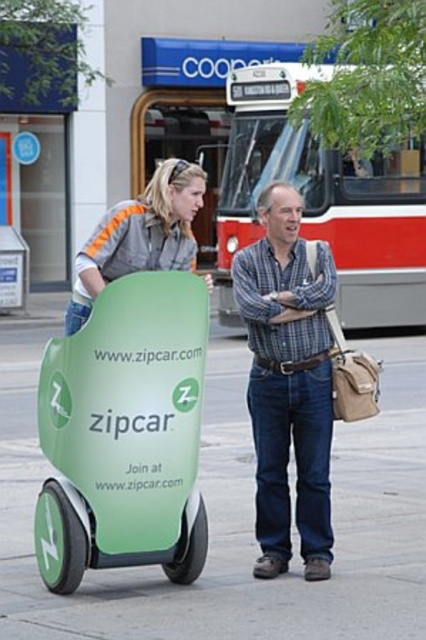
Does green matte zipcar at lower left have a smaller size compared to blue plaid shirt at center?

Actually, green matte zipcar at lower left might be larger than blue plaid shirt at center.

Does point (60, 346) come farther from viewer compared to point (258, 512)?

No.

Who is more distant from viewer, (132, 433) or (284, 410)?

The point (284, 410) is more distant.

The image size is (426, 640). Find the location of `green matte zipcar at lower left`. green matte zipcar at lower left is located at coordinates (124, 435).

Who is more forward, (282,636) or (89,260)?

Point (282,636) is more forward.

Which is in front, point (397, 378) or point (149, 237)?

Positioned in front is point (149, 237).

Locate an element on the screen. green rubber hoverboard at center is located at coordinates (236, 520).

Does green matte zipcar at lower left appear on the right side of gray fabric jacket at upper left?

Indeed, green matte zipcar at lower left is positioned on the right side of gray fabric jacket at upper left.

Find the location of a particular element. This screenshot has width=426, height=640. green matte zipcar at lower left is located at coordinates click(124, 435).

You are a GUI agent. You are given a task and a screenshot of the screen. Output one action in this format:
    pyautogui.click(x=<x>, y=<y>)
    Task: Click on the green matte zipcar at lower left
    The width and height of the screenshot is (426, 640).
    Given the screenshot: What is the action you would take?
    tap(124, 435)